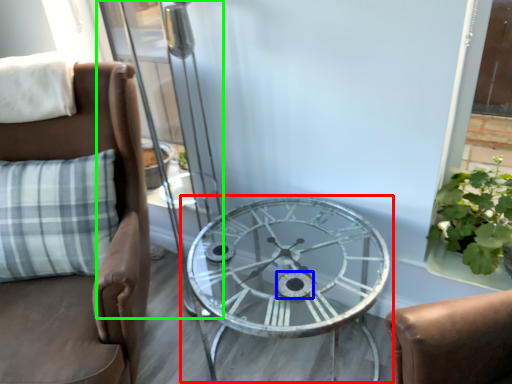
Question: Based on their relative distances, which object is nearer to table (highlighted by a red box)? Choose from oval (highlighted by a blue box) and screen door (highlighted by a green box).

Choices:
 (A) oval
 (B) screen door

Answer: (A)